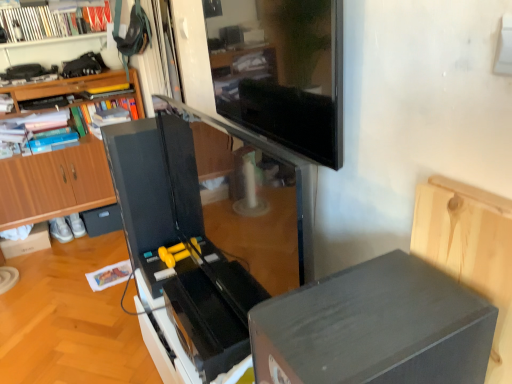
This screenshot has width=512, height=384. Describe the element at coordinates (102, 220) in the screenshot. I see `matte black drawer at lower left` at that location.

Find the location of a particular element. matte black drawer at lower left is located at coordinates (102, 220).

The image size is (512, 384). What do you see at coordinates (27, 242) in the screenshot?
I see `white cardboard box at lower left` at bounding box center [27, 242].

The image size is (512, 384). I want to click on matte black speaker at lower right, so click(x=374, y=328).

Is white cardboard box at lower left placed right next to wooden bookcase at left?

No, white cardboard box at lower left is not touching wooden bookcase at left.

Which of these two, white cardboard box at lower left or wooden bookcase at left, stands taller?

With more height is wooden bookcase at left.

Is white cardboard box at lower left bigger or smaller than wooden bookcase at left?

Considering their sizes, white cardboard box at lower left takes up less space than wooden bookcase at left.

Is wooden bookcase at left at the back of white cardboard box at lower left?

Yes, white cardboard box at lower left is positioned with its back facing wooden bookcase at left.

At what (x,y) coordinates should I click in order to perform the action: click on appliance above the matte black speaker at lower right (from a real-world perspective). Please return your answer as a coordinate pair (x, y). Looking at the image, I should click on (178, 249).

Does matte black treadmill at center have a smaller size compared to matte black speaker at lower right?

Result: No.

From the picture: From a real-world perspective, is matte black treadmill at center positioned under matte black speaker at lower right based on gravity?

No, from a real-world perspective, matte black treadmill at center is not below matte black speaker at lower right.

Is point (158, 167) positioned before point (354, 317)?

No, it is behind (354, 317).

Locate an element on the screen. This screenshot has height=384, width=512. bookcase lying below the white glossy bookshelf at upper left (from the image's perspective) is located at coordinates (54, 184).

Is wooden bookcase at left far from white glossy bookshelf at upper left?

Actually, wooden bookcase at left and white glossy bookshelf at upper left are a little close together.

Is wooden bookcase at left inside or outside of white glossy bookshelf at upper left?

wooden bookcase at left is not inside white glossy bookshelf at upper left, it's outside.

Is wooden bookcase at left facing away from white glossy bookshelf at upper left?

No, wooden bookcase at left is not facing the opposite direction of white glossy bookshelf at upper left.

In terms of width, does matte black speaker at lower right look wider or thinner when compared to white cardboard box at lower left?

matte black speaker at lower right is thinner than white cardboard box at lower left.

Which is in front, matte black speaker at lower right or white cardboard box at lower left?

matte black speaker at lower right is in front.

From the image's perspective, relative to white cardboard box at lower left, is matte black speaker at lower right above or below?

Clearly, from the image's perspective, matte black speaker at lower right is below white cardboard box at lower left.

Is white cardboard box at lower left at the back of matte black speaker at lower right?

No, matte black speaker at lower right's orientation is not away from white cardboard box at lower left.

Does matte black tv at upper center have a larger size compared to white glossy bookshelf at upper left?

Incorrect, matte black tv at upper center is not larger than white glossy bookshelf at upper left.

Is point (250, 88) more distant than point (92, 27)?

No, (250, 88) is closer to viewer.

How different are the orientations of matte black tv at upper center and white glossy bookshelf at upper left in degrees?

There is a 94.9-degree angle between the facing directions of matte black tv at upper center and white glossy bookshelf at upper left.

Looking at this image, between matte black tv at upper center and white glossy bookshelf at upper left, which one has less height?

white glossy bookshelf at upper left.

In terms of size, does matte black treadmill at center appear bigger or smaller than white cardboard box at lower left?

Considering their sizes, matte black treadmill at center takes up more space than white cardboard box at lower left.

How different are the orientations of matte black treadmill at center and white cardboard box at lower left in degrees?

91.5 degrees separate the facing orientations of matte black treadmill at center and white cardboard box at lower left.

Does point (115, 151) appear closer or farther from the camera than point (48, 247)?

Clearly, point (115, 151) is closer to the camera than point (48, 247).

Is the depth of white cardboard box at lower left greater than that of white glossy bookshelf at upper left?

Yes, it is behind white glossy bookshelf at upper left.

From the image's perspective, which is above, white cardboard box at lower left or white glossy bookshelf at upper left?

white glossy bookshelf at upper left is shown above in the image.

Is white cardboard box at lower left situated inside white glossy bookshelf at upper left or outside?

white cardboard box at lower left exists outside the volume of white glossy bookshelf at upper left.

This screenshot has height=384, width=512. What are the coordinates of `cardboard box located below the wooden bookcase at left (from the image's perspective)` in the screenshot? It's located at (27, 242).

Where is `appliance that is behind the matte black speaker at lower right`? Image resolution: width=512 pixels, height=384 pixels. appliance that is behind the matte black speaker at lower right is located at coordinates (178, 249).

Looking at the image, which one is located closer to matte black tv at upper center, wooden bookcase at left or white cardboard box at lower left?

Based on the image, wooden bookcase at left appears to be nearer to matte black tv at upper center.

Considering their positions, is matte black speaker at lower right positioned further to white glossy bookshelf at upper left than wooden bookcase at left?

matte black speaker at lower right lies further to white glossy bookshelf at upper left than the other object.

Considering their positions, is matte black speaker at lower right positioned closer to wooden bookcase at left than matte black drawer at lower left?

matte black drawer at lower left.

Looking at the image, which one is located further to matte black speaker at lower right, wooden bookcase at left or matte black drawer at lower left?

Among the two, matte black drawer at lower left is located further to matte black speaker at lower right.

Considering their positions, is wooden bookcase at left positioned closer to white cardboard box at lower left than white glossy bookshelf at upper left?

wooden bookcase at left.

Looking at the image, which one is located further to white glossy bookshelf at upper left, wooden bookcase at left or matte black tv at upper center?

Based on the image, matte black tv at upper center appears to be further to white glossy bookshelf at upper left.

Considering their positions, is matte black tv at upper center positioned further to white glossy bookshelf at upper left than matte black speaker at lower right?

matte black speaker at lower right is further to white glossy bookshelf at upper left.

Which object lies nearer to the anchor point matte black treadmill at center, white glossy bookshelf at upper left or white cardboard box at lower left?

The object closer to matte black treadmill at center is white glossy bookshelf at upper left.

The image size is (512, 384). I want to click on book between matte black treadmill at center and matte black drawer at lower left from front to back, so click(x=52, y=22).

The image size is (512, 384). I want to click on appliance located between matte black speaker at lower right and matte black drawer at lower left in the depth direction, so click(178, 249).

This screenshot has height=384, width=512. In order to click on book positioned between matte black tv at upper center and matte black drawer at lower left from near to far in this screenshot , I will do `click(52, 22)`.

Locate an element on the screen. cardboard box between matte black speaker at lower right and matte black drawer at lower left along the z-axis is located at coordinates (27, 242).